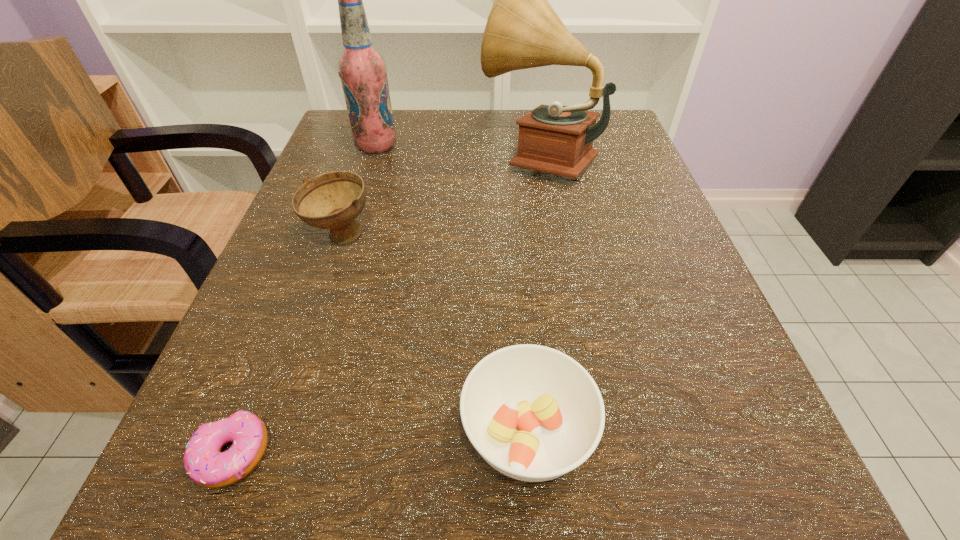
I want to click on phonograph record, so click(x=523, y=31).

In order to click on alcohol in this screenshot , I will do `click(362, 69)`.

You are a GUI agent. You are given a task and a screenshot of the screen. Output one action in this format:
    pyautogui.click(x=<x>, y=<y>)
    Task: Click on the third shortest object
    This screenshot has height=540, width=960.
    Given the screenshot: What is the action you would take?
    pyautogui.click(x=333, y=200)

The image size is (960, 540). What are the coordinates of `the third farthest object` in the screenshot? It's located at [333, 200].

Locate an element on the screen. the right soup bowl is located at coordinates (533, 413).

I want to click on the shorter soup bowl, so click(533, 413).

This screenshot has height=540, width=960. In order to click on doughnut in this screenshot , I will do `click(205, 464)`.

Find the location of a particular element. The image size is (960, 540). free region located 0.140m on the horn of the phonograph record is located at coordinates pyautogui.click(x=412, y=156).

Image resolution: width=960 pixels, height=540 pixels. I want to click on vacant point located 0.270m on the horn of the phonograph record, so click(x=348, y=156).

Where is `blank area located on the horn of the phonograph record`? blank area located on the horn of the phonograph record is located at coordinates (372, 156).